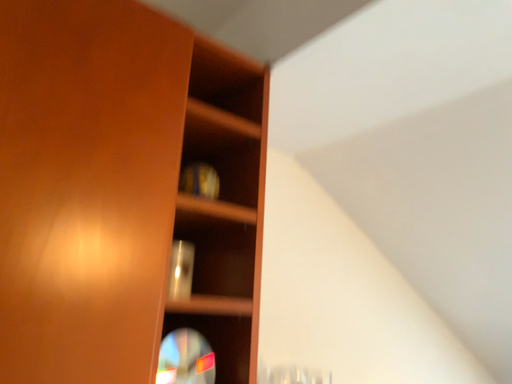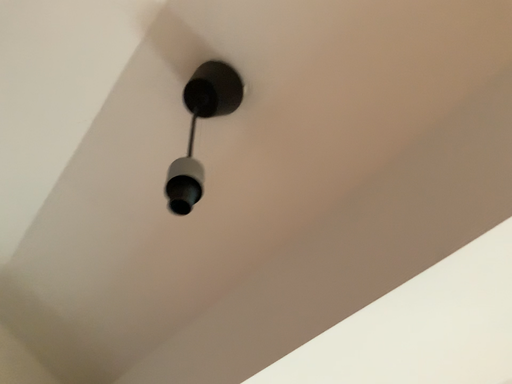
Question: Which way did the camera rotate in the video?

Choices:
 (A) rotated downward
 (B) rotated upward

Answer: (B)